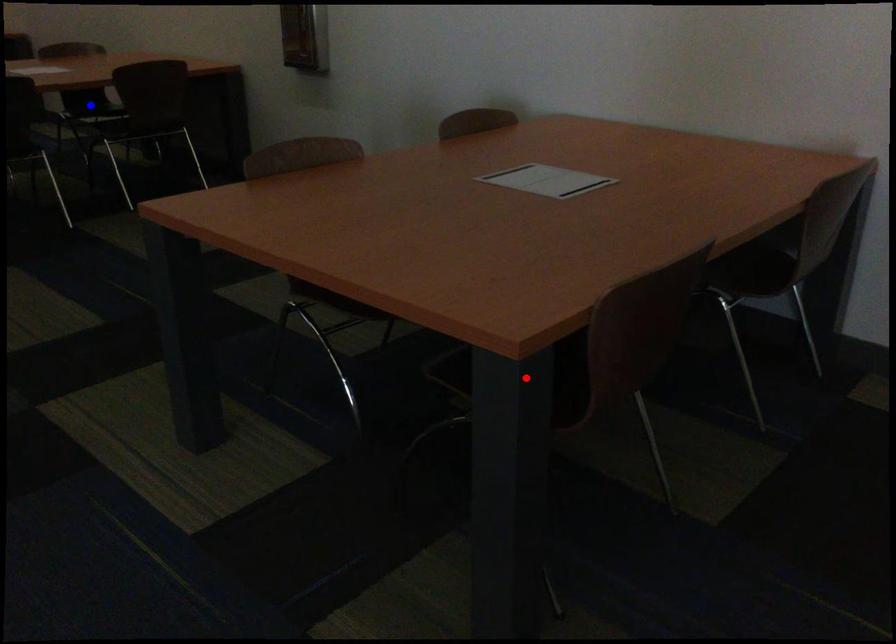
Question: In the image, two points are highlighted. Which point is nearer to the camera? Reply with the corresponding letter.

Choices:
 (A) blue point
 (B) red point

Answer: (B)